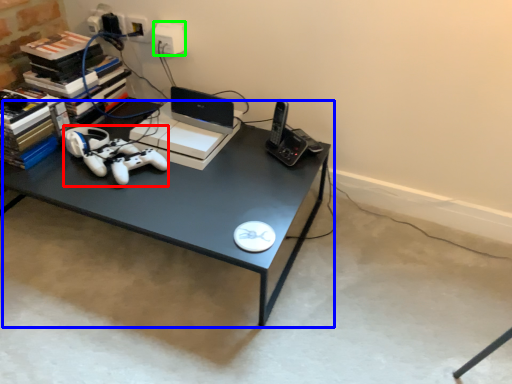
Question: Which object is positioned closest to game controller (highlighted by a red box)? Select from desk (highlighted by a blue box) and electric outlet (highlighted by a green box).

Choices:
 (A) desk
 (B) electric outlet

Answer: (A)